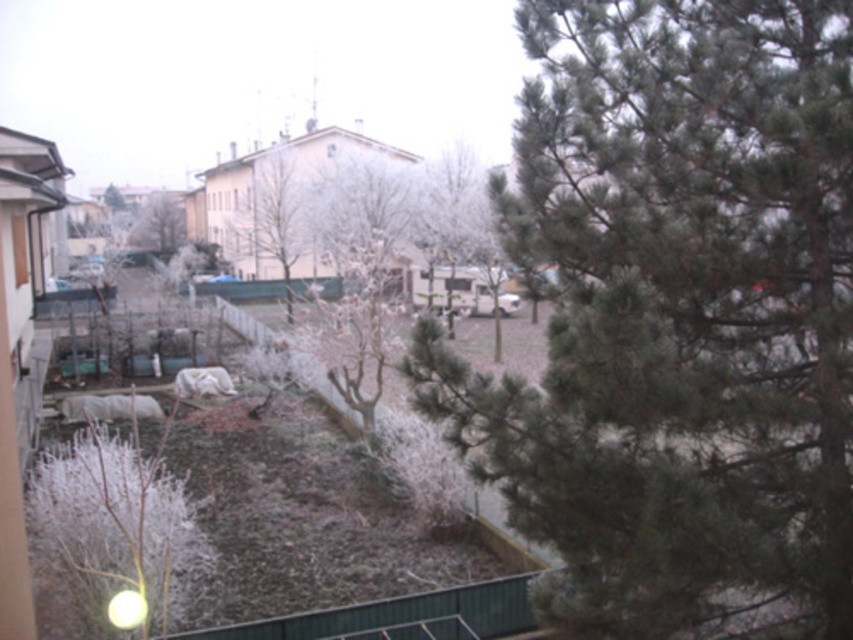
You are standing at the point with coordinates point (103, 630) and want to walk towards the point with coordinates point (183, 198). Will you be moving towards the foreground or background of the image?

Since point (103, 630) is in front of point (183, 198), moving from point (103, 630) towards point (183, 198) means you are moving towards the background of the image.

You are a bird looking for a place to land. You see a bare wood tree at center and a green matte tree at center. Which tree is closer to you?

The bare wood tree at center is closer to you because it is in front of the green matte tree at center.